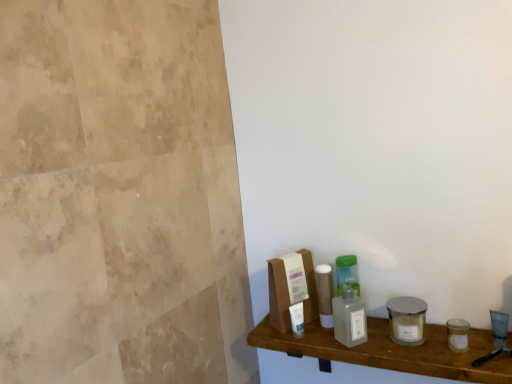
Identify the location of blank space above translucent plastic bottles at center (from a real-world perspective). Image resolution: width=512 pixels, height=384 pixels. (387, 345).